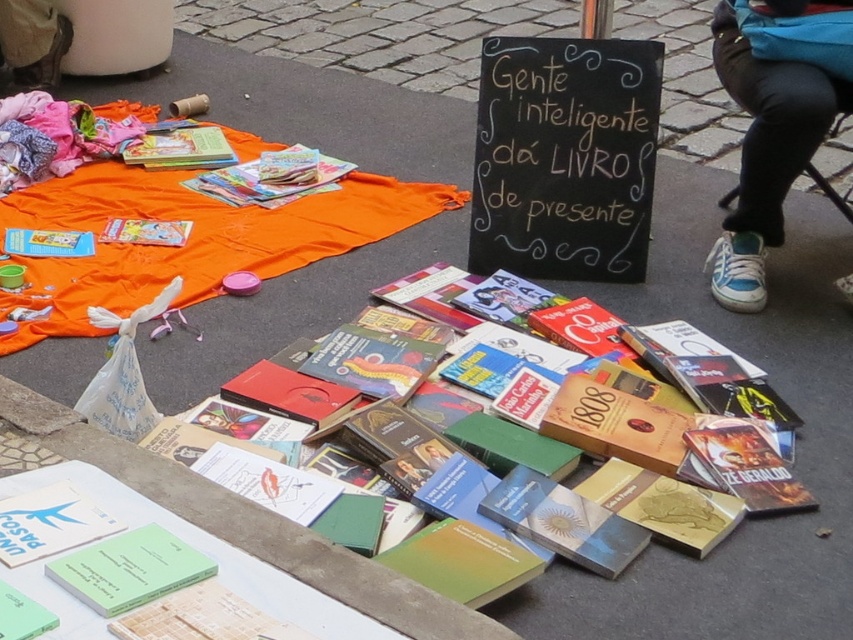
Identify the location of black chalkboard at center. (564, 157).

Does black chalkboard at center appear over blue canvas shoe at lower right?

Incorrect, black chalkboard at center is not positioned above blue canvas shoe at lower right.

Describe the element at coordinates (564, 157) in the screenshot. This screenshot has height=640, width=853. I see `black chalkboard at center` at that location.

This screenshot has height=640, width=853. Find the location of `black chalkboard at center`. black chalkboard at center is located at coordinates (564, 157).

Is orange fabric at upper left taller than green paper book at lower center?

Yes, orange fabric at upper left is taller than green paper book at lower center.

Between orange fabric at upper left and green paper book at lower center, which one is positioned higher?

Positioned higher is orange fabric at upper left.

Find the location of a particular element. orange fabric at upper left is located at coordinates (187, 237).

Is point (93, 332) closer to camera compared to point (767, 230)?

Yes, it is in front of point (767, 230).

Who is taller, orange fabric at upper left or blue canvas shoe at lower right?

Standing taller between the two is blue canvas shoe at lower right.

Between point (165, 269) and point (755, 61), which one is positioned behind?

Point (165, 269)

The image size is (853, 640). I want to click on orange fabric at upper left, so click(x=187, y=237).